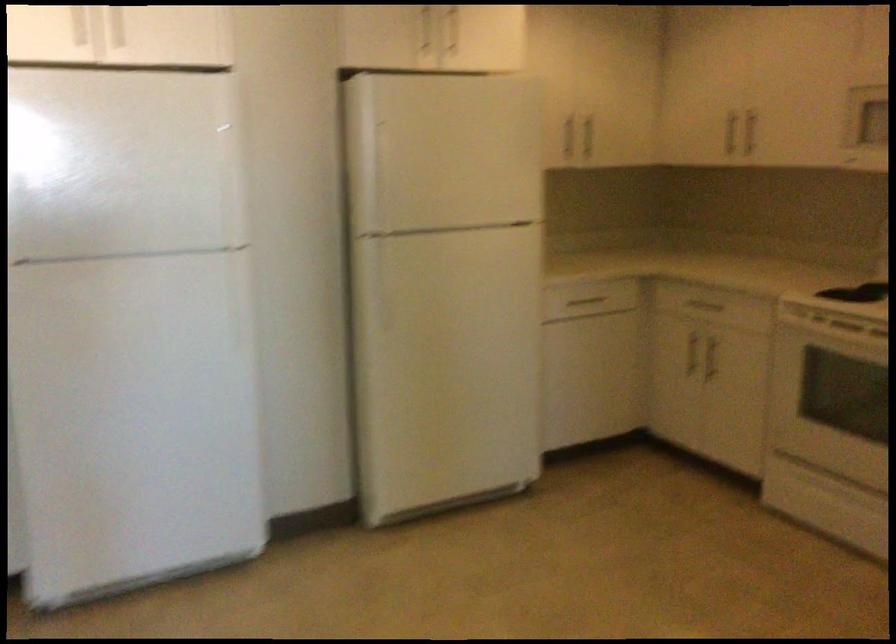
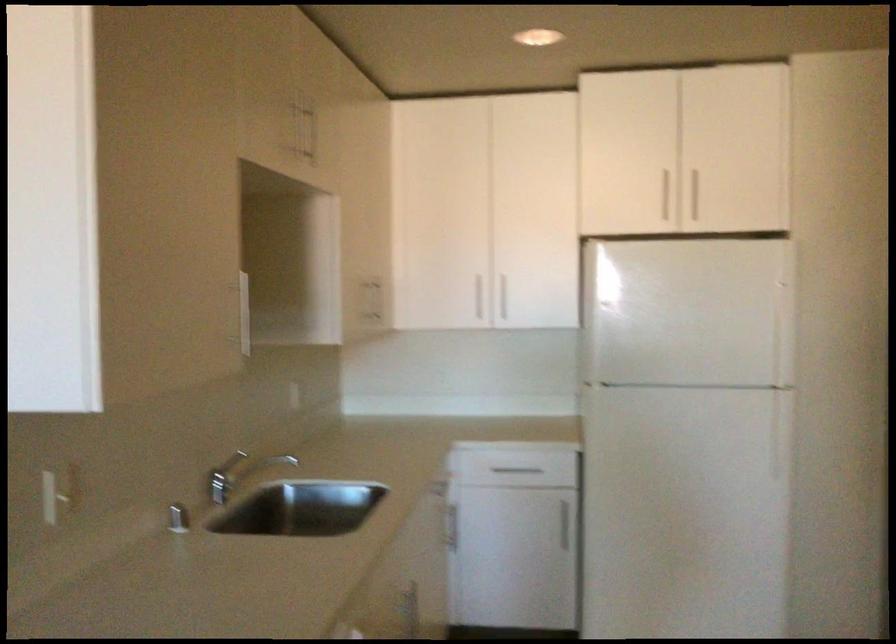
Where in the second image is the point corresponding to (x=107, y=163) from the first image?

(687, 313)